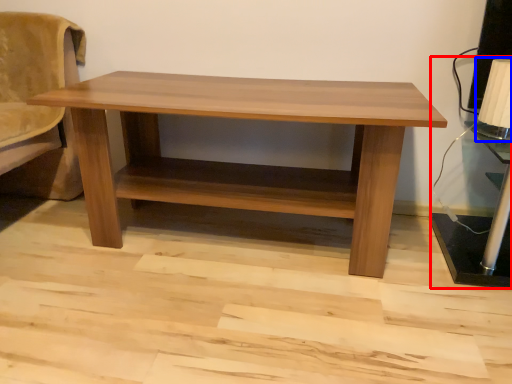
Question: Which point is further to the camera, table lamp (highlighted by a red box) or table lamp (highlighted by a blue box)?

Choices:
 (A) table lamp
 (B) table lamp

Answer: (B)